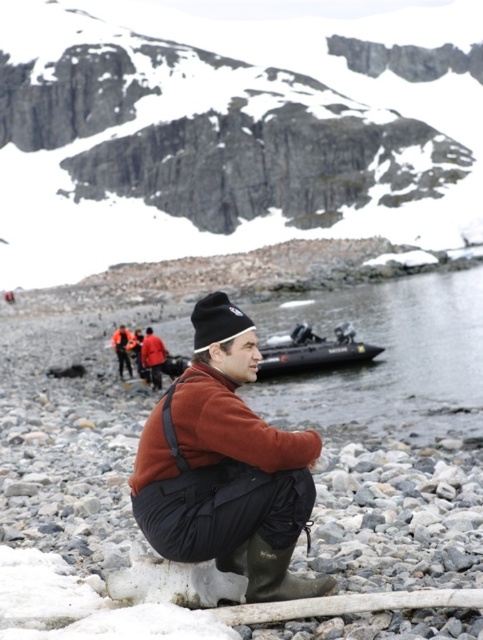
Based on the photo, you are a hiker trying to locate your gear. You see the white matte snow at upper center and the matte brown jacket at center. Which object is positioned higher in the image?

The white matte snow at upper center is located above the matte brown jacket at center, so it is positioned higher in the image.

You are planning to set up a tent for shelter in this mountainous area. The white matte snow at upper center and the rubber inflatable boat at center are both visible from your current position. Which of these two objects is higher in elevation?

The white matte snow at upper center is higher in elevation than the rubber inflatable boat at center because it has a greater height compared to the boat.